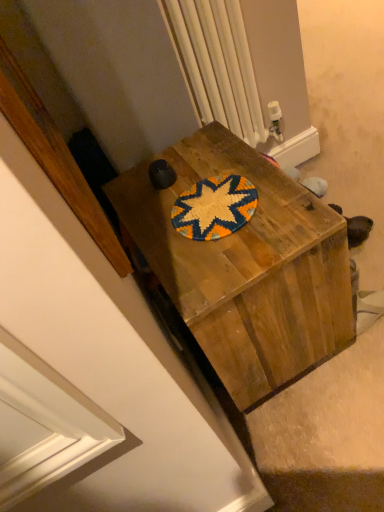
The width and height of the screenshot is (384, 512). Find the location of `wooden desk at center`. wooden desk at center is located at coordinates (246, 267).

The height and width of the screenshot is (512, 384). Describe the element at coordinates (246, 267) in the screenshot. I see `wooden desk at center` at that location.

This screenshot has width=384, height=512. What do you see at coordinates (218, 64) in the screenshot?
I see `white plastic radiator at upper center` at bounding box center [218, 64].

In order to face white plastic radiator at upper center, should I rotate leftwards or rightwards?

Turn right approximately 5.835 degrees to face it.

You are a GUI agent. You are given a task and a screenshot of the screen. Output one action in this format:
    pyautogui.click(x=<x>, y=<y>)
    Task: Click on the white plastic radiator at upper center
    
    Given the screenshot: What is the action you would take?
    pyautogui.click(x=218, y=64)

The width and height of the screenshot is (384, 512). I want to click on wooden desk at center, so click(x=246, y=267).

Based on their positions, is white plastic radiator at upper center located to the left or right of wooden desk at center?

From the image, it's evident that white plastic radiator at upper center is to the right of wooden desk at center.

Is white plastic radiator at upper center further to camera compared to wooden desk at center?

Yes.

Considering the positions of point (182, 34) and point (168, 217), is point (182, 34) closer or farther from the camera than point (168, 217)?

Point (182, 34).

From the image's perspective, between white plastic radiator at upper center and wooden desk at center, who is located below?

From the image's view, wooden desk at center is below.

From the picture: From a real-world perspective, which object rests below the other?

wooden desk at center is physically lower.

Between white plastic radiator at upper center and wooden desk at center, which one has larger width?

With larger width is wooden desk at center.

Which of these two, white plastic radiator at upper center or wooden desk at center, stands taller?

white plastic radiator at upper center.

Between white plastic radiator at upper center and wooden desk at center, which one has smaller size?

white plastic radiator at upper center is smaller.

Is wooden desk at center completely or partially inside white plastic radiator at upper center?

No, wooden desk at center is not inside white plastic radiator at upper center.

Looking at this image, are white plastic radiator at upper center and wooden desk at center beside each other?

white plastic radiator at upper center and wooden desk at center are not in contact.

Is white plastic radiator at upper center turned away from wooden desk at center?

No, white plastic radiator at upper center's orientation is not away from wooden desk at center.

What's the angular difference between white plastic radiator at upper center and wooden desk at center's facing directions?

The angular difference between white plastic radiator at upper center and wooden desk at center is 92.5 degrees.

Locate an element on the screen. This screenshot has width=384, height=512. desk below the white plastic radiator at upper center (from a real-world perspective) is located at coordinates (246, 267).

Between wooden desk at center and white plastic radiator at upper center, which one appears on the right side from the viewer's perspective?

Positioned to the right is white plastic radiator at upper center.

Considering the positions of objects wooden desk at center and white plastic radiator at upper center in the image provided, who is behind, wooden desk at center or white plastic radiator at upper center?

white plastic radiator at upper center is further away from the camera.

Is point (304, 360) farther from viewer compared to point (207, 50)?

No, (304, 360) is in front of (207, 50).

From the image's perspective, relative to white plastic radiator at upper center, is wooden desk at center above or below?

Clearly, from the image's perspective, wooden desk at center is below white plastic radiator at upper center.

From a real-world perspective, is wooden desk at center located beneath white plastic radiator at upper center?

Correct, in the physical world, wooden desk at center is lower than white plastic radiator at upper center.

Between wooden desk at center and white plastic radiator at upper center, which one has smaller width?

white plastic radiator at upper center.

Which of these two, wooden desk at center or white plastic radiator at upper center, stands taller?

With more height is white plastic radiator at upper center.

Looking at this image, considering the relative sizes of wooden desk at center and white plastic radiator at upper center in the image provided, is wooden desk at center smaller than white plastic radiator at upper center?

No.

Would you say white plastic radiator at upper center is part of wooden desk at center's contents?

Definitely not — white plastic radiator at upper center is not inside wooden desk at center.

Are wooden desk at center and white plastic radiator at upper center making contact?

No.

Does wooden desk at center turn towards white plastic radiator at upper center?

No.

What's the angular difference between wooden desk at center and white plastic radiator at upper center's facing directions?

92.5 degrees.

Locate an element on the screen. This screenshot has height=512, width=384. radiator behind the wooden desk at center is located at coordinates (218, 64).

Locate an element on the screen. Image resolution: width=384 pixels, height=512 pixels. radiator above the wooden desk at center (from a real-world perspective) is located at coordinates (218, 64).

At what (x,y) coordinates should I click in order to perform the action: click on radiator that appears above the wooden desk at center (from the image's perspective). Please return your answer as a coordinate pair (x, y). Looking at the image, I should click on (218, 64).